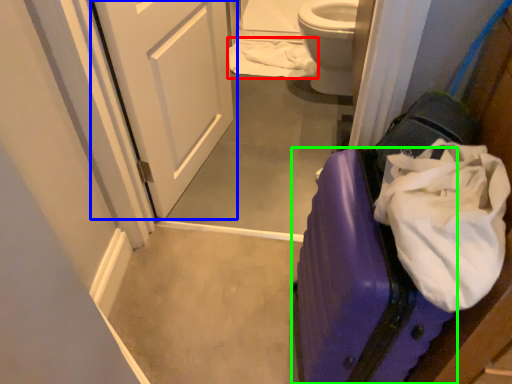
Question: Based on their relative distances, which object is farther from toilet paper (highlighted by a red box)? Choose from door (highlighted by a blue box) and suitcase (highlighted by a green box).

Choices:
 (A) door
 (B) suitcase

Answer: (B)